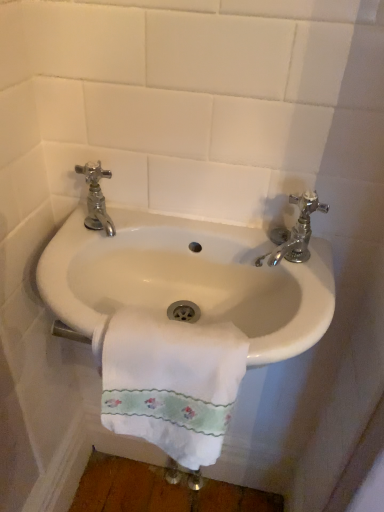
This screenshot has height=512, width=384. What are the coordinates of `empty space that is to the right of chrome/metallic faucet at upper left, arranged as the 1th tap when viewed from the left` in the screenshot? It's located at (188, 227).